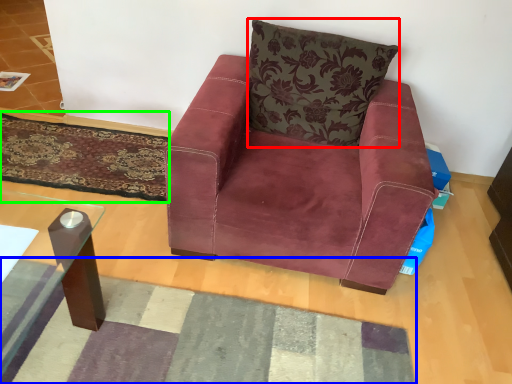
Question: Which is farther away from pillow (highlighted by a red box)? mat (highlighted by a blue box) or mat (highlighted by a green box)?

Choices:
 (A) mat
 (B) mat

Answer: (A)